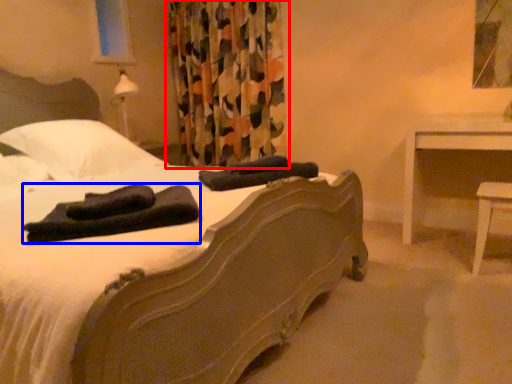
Question: Among these objects, which one is nearest to the camera, curtain (highlighted by a red box) or material (highlighted by a blue box)?

Choices:
 (A) curtain
 (B) material

Answer: (B)